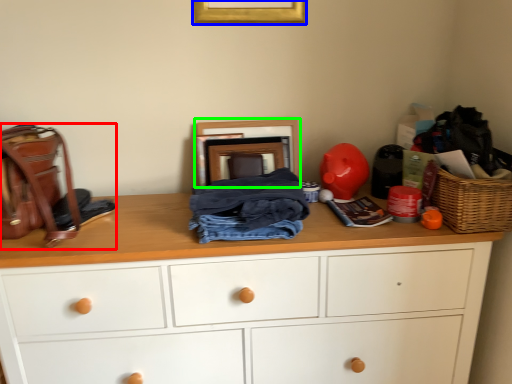
Question: Estimate the real-world distances between objects in this image. Which object is farther from handbag (highlighted by a red box), picture frame (highlighted by a blue box) or picture frame (highlighted by a green box)?

Choices:
 (A) picture frame
 (B) picture frame

Answer: (A)